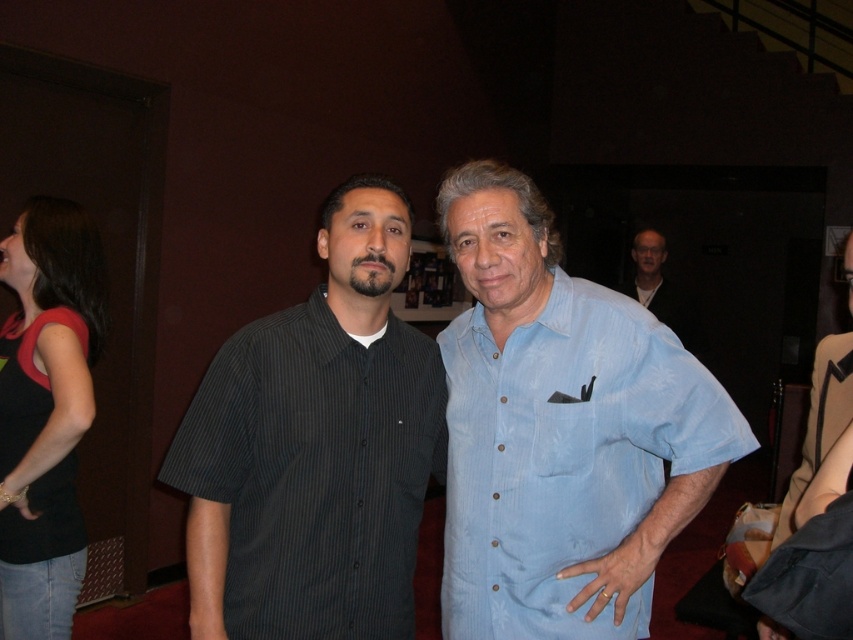
You are a photographer standing 2 meters away from the two people in the image. You want to take a photo of both the light blue cotton shirt at center and the dark gray striped shirt at center in the same frame. Given that your camera has a maximum field of view of 2 meters, will both shirts fit in the frame?

The light blue cotton shirt at center and dark gray striped shirt at center are 23.64 centimeters apart from each other. Since the distance between them is less than 2 meters, both shirts will fit within the camera frame.

You are standing at the point with coordinates point (22, 428) and want to walk towards the point with coordinates point (280, 433). Will you be moving forward or backward relative to your current position?

Since point (280, 433) is in front of point (22, 428), you will be moving forward relative to your current position.

You are a photographer setting up for a group photo and need to ensure there is enough space between the dark gray striped shirt at center and the black fabric top at left to avoid overlapping in the photo. The minimum required distance for no overlap is 30 inches. Can the current spacing accommodate this?

The dark gray striped shirt at center is 31.92 inches from the black fabric top at left, which exceeds the minimum required distance of 30 inches. Therefore, the current spacing can accommodate the no overlap requirement.